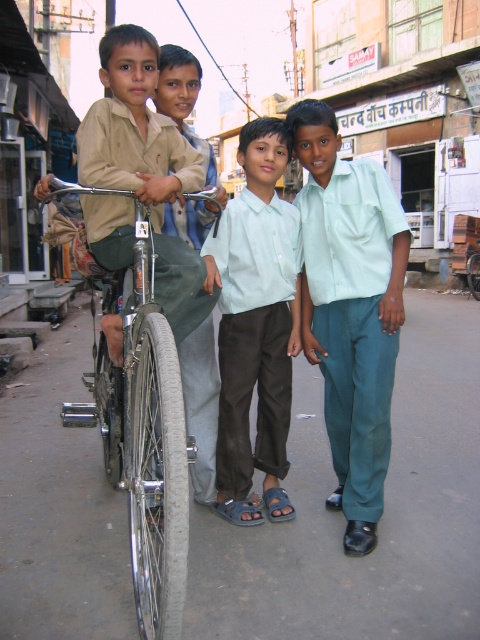
Who is taller, light green fabric shirt at center or matte khaki shirt at left?

matte khaki shirt at left is taller.

In the scene shown: Is light green fabric shirt at center smaller than matte khaki shirt at left?

Yes, light green fabric shirt at center is smaller than matte khaki shirt at left.

Who is more forward, [302,241] or [167,188]?

Point [167,188]

Find the location of a particular element. light green fabric shirt at center is located at coordinates (350, 308).

Who is positioned more to the left, light green fabric shirt at center or shiny metallic bicycle at left?

From the viewer's perspective, shiny metallic bicycle at left appears more on the left side.

Does light green fabric shirt at center appear on the left side of shiny metallic bicycle at left?

In fact, light green fabric shirt at center is to the right of shiny metallic bicycle at left.

Locate an element on the screen. light green fabric shirt at center is located at coordinates (350, 308).

What are the coordinates of `light green fabric shirt at center` in the screenshot? It's located at (350, 308).

Describe the element at coordinates (255, 324) in the screenshot. I see `light green cotton shirt at center` at that location.

Can you confirm if light green cotton shirt at center is positioned above shiny metallic bicycle at left?

Indeed, light green cotton shirt at center is positioned over shiny metallic bicycle at left.

Does point (249, 465) lie behind point (151, 636)?

Yes, point (249, 465) is behind point (151, 636).

Where is `light green cotton shirt at center`? The width and height of the screenshot is (480, 640). light green cotton shirt at center is located at coordinates (255, 324).